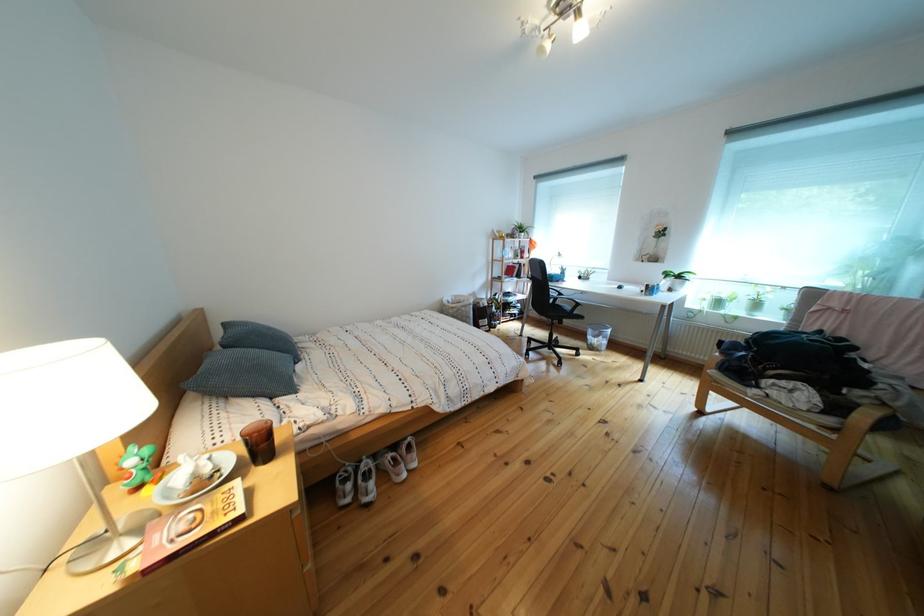
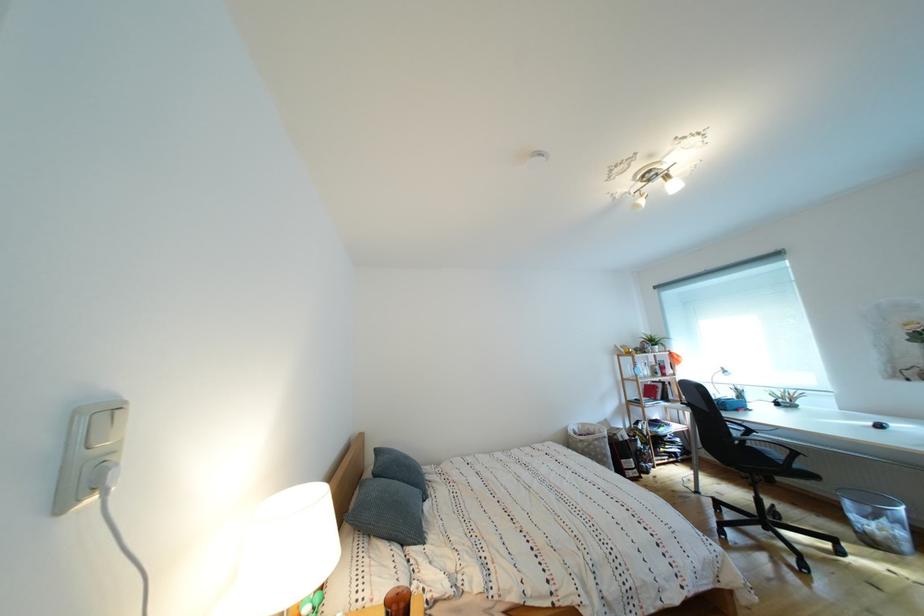
Find the pixel in the second image that matches point 468,302 in the first image.

(594, 430)